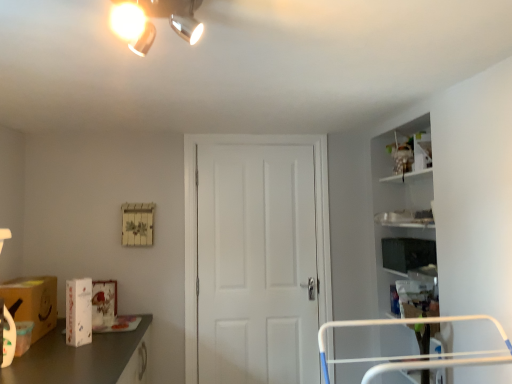
Question: From the image's perspective, is matte black tv at right, the 2th box viewed from the front, positioned above or below matte brown cardboard box at lower left?

Choices:
 (A) above
 (B) below

Answer: (A)

Question: Which is correct: matte black tv at right, which ranks as the 1th box in back-to-front order, is inside matte brown cardboard box at lower left, or outside of it?

Choices:
 (A) outside
 (B) inside

Answer: (A)

Question: Which object is positioned farthest from the white matte door at center?

Choices:
 (A) matte silver light fixture at upper center
 (B) white glossy box at lower left, which ranks as the first box in bottom-to-top order
 (C) matte brown cardboard box at lower left
 (D) matte black tv at right, the 2th box viewed from the front

Answer: (A)

Question: Considering the real-world distances, which object is farthest from the matte black tv at right, the 2th box from the bottom?

Choices:
 (A) matte silver light fixture at upper center
 (B) white glossy box at lower left, which is the 1th box from front to back
 (C) white matte door at center
 (D) matte brown cardboard box at lower left

Answer: (D)